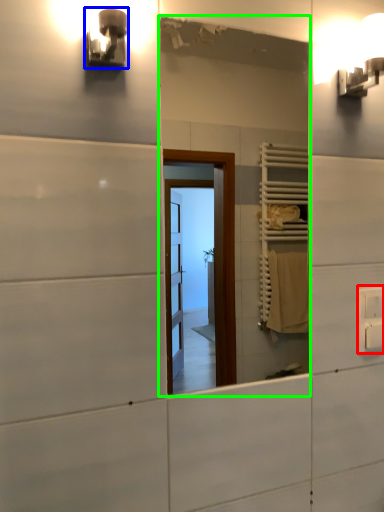
Question: Which object is positioned farthest from electric outlet (highlighted by a red box)? Select from light fixture (highlighted by a blue box) and mirror (highlighted by a green box).

Choices:
 (A) light fixture
 (B) mirror

Answer: (B)